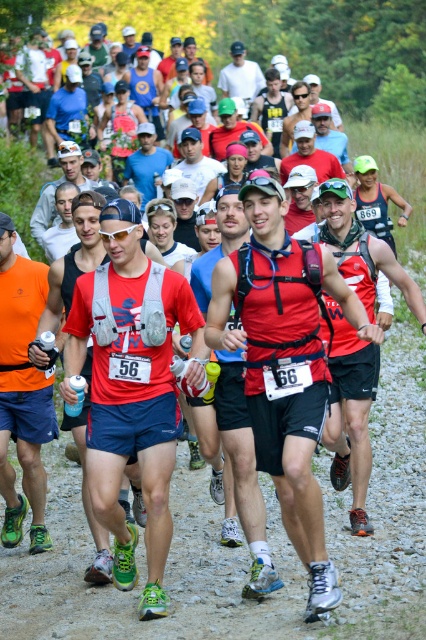
Question: Can you confirm if matte gray vest at center is bigger than matte black cap at center?

Choices:
 (A) no
 (B) yes

Answer: (A)

Question: Which of the following is the closest to the observer?

Choices:
 (A) white matte cap at center
 (B) matte orange tank top at center
 (C) matte gray vest at center
 (D) matte red tank top at center

Answer: (D)

Question: Which of the following is the farthest from the observer?

Choices:
 (A) (149, 88)
 (B) (167, 163)
 (C) (284, 465)
 (D) (195, 132)

Answer: (A)

Question: Is matte gray vest at center above matte black cap at center?

Choices:
 (A) yes
 (B) no

Answer: (B)

Question: Is matte red tank top at center smaller than matte blue tank top at center?

Choices:
 (A) no
 (B) yes

Answer: (B)

Question: Based on their relative distances, which object is nearer to the matte blue tank top at center?

Choices:
 (A) matte gray vest at center
 (B) white matte cap at center

Answer: (A)